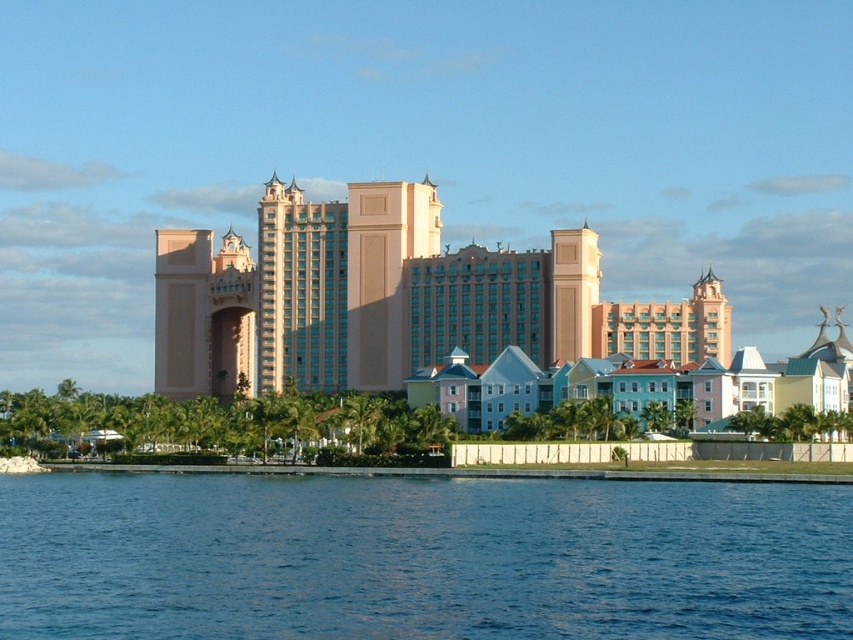
Question: Does blue liquid water at lower center have a greater width compared to pink smooth building at center?

Choices:
 (A) no
 (B) yes

Answer: (A)

Question: From the image, what is the correct spatial relationship of blue liquid water at lower center in relation to pink smooth building at center?

Choices:
 (A) left
 (B) right

Answer: (A)

Question: Which of the following is the closest to the observer?

Choices:
 (A) blue liquid water at lower center
 (B) pink smooth building at center

Answer: (A)

Question: Can you confirm if blue liquid water at lower center is positioned to the right of pink smooth building at center?

Choices:
 (A) yes
 (B) no

Answer: (B)

Question: Which object appears closest to the camera in this image?

Choices:
 (A) blue liquid water at lower center
 (B) pink smooth building at center

Answer: (A)